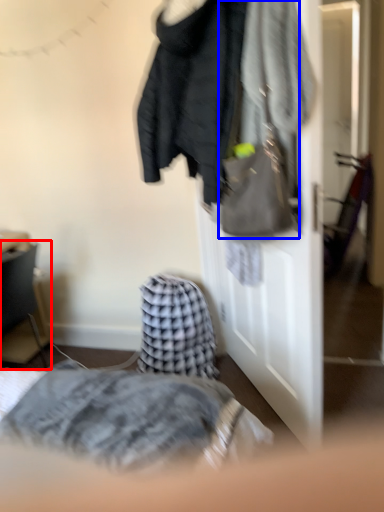
Question: Which object appears closest to the camera in this image, furniture (highlighted by a red box) or handbag (highlighted by a blue box)?

Choices:
 (A) furniture
 (B) handbag

Answer: (B)